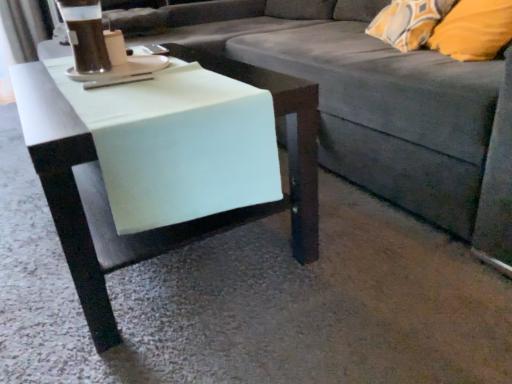
Question: Could you tell me if white glossy saucer at upper left is facing white matte table at center?

Choices:
 (A) no
 (B) yes

Answer: (A)

Question: Would you say white glossy saucer at upper left is a long distance from white matte table at center?

Choices:
 (A) no
 (B) yes

Answer: (A)

Question: From the image's perspective, is white glossy saucer at upper left located above white matte table at center?

Choices:
 (A) yes
 (B) no

Answer: (A)

Question: From a real-world perspective, is white glossy saucer at upper left located beneath white matte table at center?

Choices:
 (A) no
 (B) yes

Answer: (A)

Question: Does white glossy saucer at upper left come behind white matte table at center?

Choices:
 (A) yes
 (B) no

Answer: (A)

Question: Does white glossy saucer at upper left have a lesser width compared to white matte table at center?

Choices:
 (A) yes
 (B) no

Answer: (A)

Question: Is gray fabric couch at center not near white matte table at center?

Choices:
 (A) no
 (B) yes

Answer: (A)

Question: From a real-world perspective, is gray fabric couch at center over white matte table at center?

Choices:
 (A) yes
 (B) no

Answer: (A)

Question: Is gray fabric couch at center outside white matte table at center?

Choices:
 (A) no
 (B) yes

Answer: (B)

Question: Is gray fabric couch at center closer to the viewer compared to white matte table at center?

Choices:
 (A) no
 (B) yes

Answer: (B)

Question: Considering the relative sizes of gray fabric couch at center and white matte table at center in the image provided, is gray fabric couch at center wider than white matte table at center?

Choices:
 (A) no
 (B) yes

Answer: (B)

Question: From the image's perspective, is gray fabric couch at center beneath white matte table at center?

Choices:
 (A) yes
 (B) no

Answer: (B)

Question: Considering the relative positions of gray fabric couch at center and dark brown liquid at upper left in the image provided, is gray fabric couch at center to the left of dark brown liquid at upper left from the viewer's perspective?

Choices:
 (A) yes
 (B) no

Answer: (B)